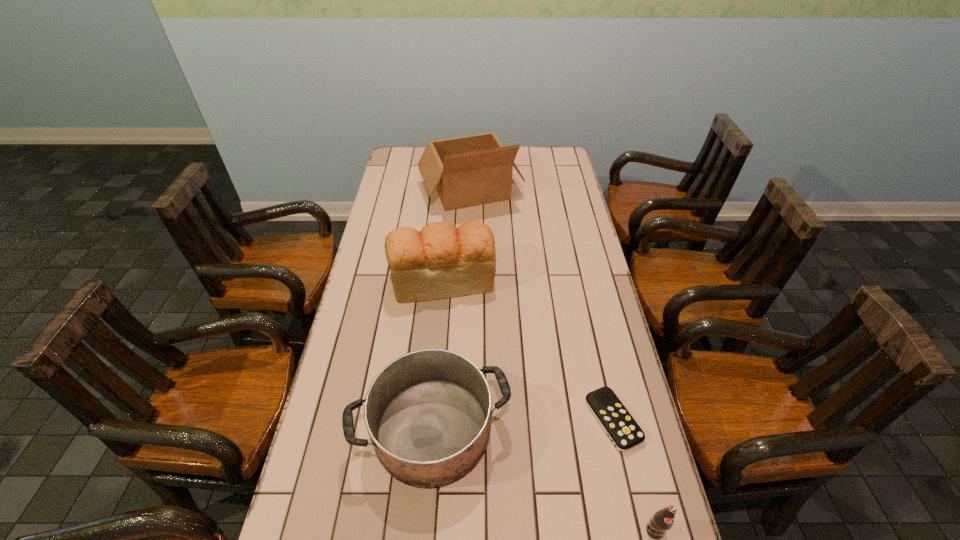
I want to click on the tallest object, so click(x=467, y=171).

Locate an element on the screen. The height and width of the screenshot is (540, 960). the farthest object is located at coordinates (467, 171).

Locate an element on the screen. The width and height of the screenshot is (960, 540). the second tallest object is located at coordinates point(441,261).

Identify the location of bread. The width and height of the screenshot is (960, 540). (441, 261).

The image size is (960, 540). Identify the location of saucepan. (428, 413).

Where is `remote control`? remote control is located at coordinates (619, 425).

Locate an element on the screen. This screenshot has height=540, width=960. vacant region located 0.070m on the right of the farthest object is located at coordinates (539, 190).

At what (x,y) coordinates should I click in order to perform the action: click on vacant region located on the front of the fourth nearest object. Please return your answer as a coordinate pair (x, y). This screenshot has height=540, width=960. Looking at the image, I should click on (438, 349).

The width and height of the screenshot is (960, 540). Find the location of `free space located on the back of the saucepan`. free space located on the back of the saucepan is located at coordinates (442, 319).

The image size is (960, 540). I want to click on vacant region located on the left of the shortest object, so click(x=471, y=420).